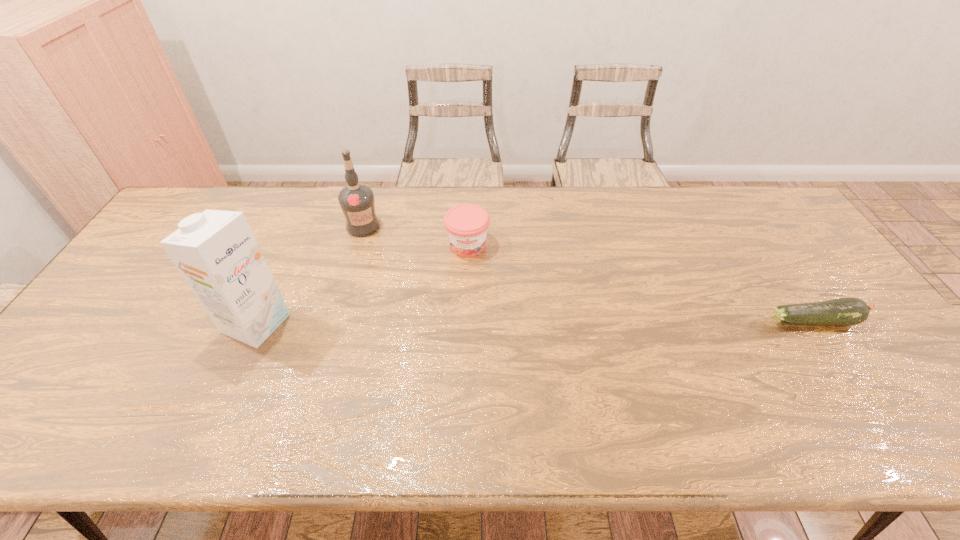
You are a GUI agent. You are given a task and a screenshot of the screen. Output one action in this format:
    pyautogui.click(x=<x>, y=<y>)
    Task: Click on the vacant space on the desktop that is between the carton and the zucchini and is positioned on the front label of the second object from right to left
    The image size is (960, 540).
    Given the screenshot: What is the action you would take?
    pyautogui.click(x=475, y=322)

Find the location of a particular element. The height and width of the screenshot is (540, 960). vacant spot on the desktop that is between the carton and the rightmost object and is positioned on the front label of the vodka is located at coordinates (465, 322).